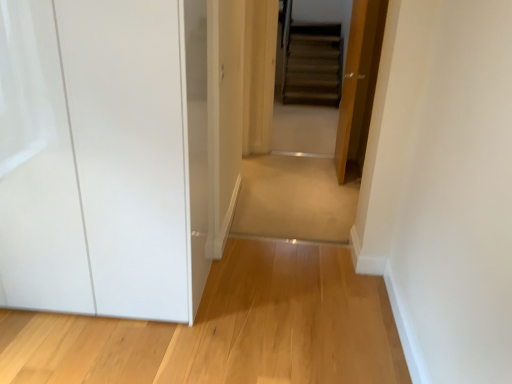
Question: From the image's perspective, relative to beige carpet at center, positioned as the second path in front-to-back order, is transparent glossy cabinet at left above or below?

Choices:
 (A) above
 (B) below

Answer: (A)

Question: Choose the correct answer: Is transparent glossy cabinet at left inside beige carpet at center, positioned as the second path in front-to-back order, or outside it?

Choices:
 (A) inside
 (B) outside

Answer: (B)

Question: Which is nearer to the beige carpet at center, positioned as the second path in front-to-back order?

Choices:
 (A) wooden door at center
 (B) transparent glossy cabinet at left
 (C) light wood floor at lower left, acting as the first path starting from the bottom

Answer: (A)

Question: Based on their relative distances, which object is farther from the transparent glossy cabinet at left?

Choices:
 (A) light wood floor at lower left, which is counted as the 1th path, starting from the front
 (B) wooden door at center
 (C) beige carpet at center, which ranks as the first path in back-to-front order

Answer: (B)